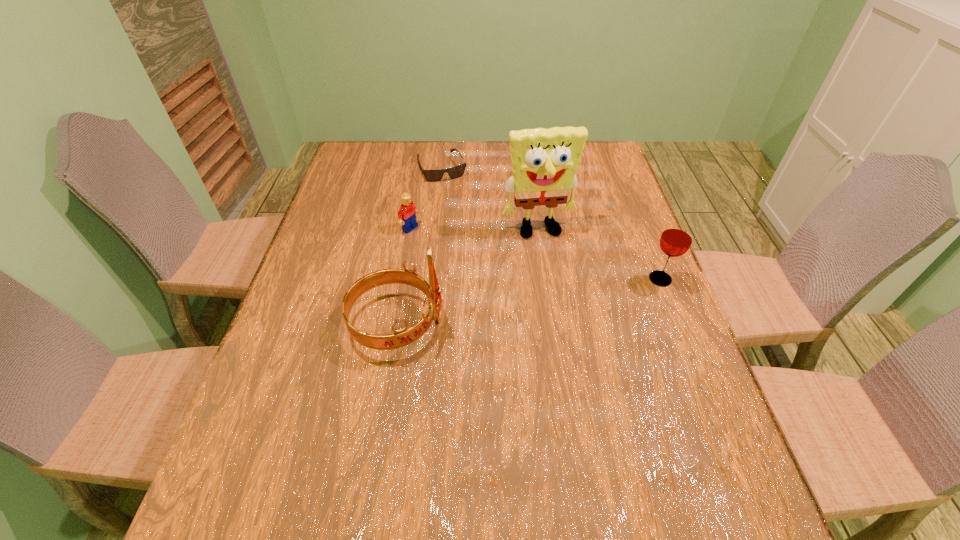
You are a GUI agent. You are given a task and a screenshot of the screen. Output one action in this format:
    pyautogui.click(x=<x>, y=<y>)
    Task: Click on the tiara
    The image size is (960, 540).
    Given the screenshot: What is the action you would take?
    pyautogui.click(x=402, y=337)

You are a GUI agent. You are given a task and a screenshot of the screen. Output one action in this format:
    pyautogui.click(x=<x>, y=<y>)
    Task: Click on the nearest object
    
    Given the screenshot: What is the action you would take?
    pyautogui.click(x=402, y=337)

Locate an element on the screen. The height and width of the screenshot is (540, 960). glass is located at coordinates (676, 239).

The width and height of the screenshot is (960, 540). I want to click on the rightmost object, so click(x=676, y=239).

Find the location of a particular element. This screenshot has width=960, height=540. the second object from right to left is located at coordinates (544, 161).

At what (x,y) coordinates should I click in order to perform the action: click on the tallest object. Please return your answer as a coordinate pair (x, y). Image resolution: width=960 pixels, height=540 pixels. Looking at the image, I should click on (544, 161).

At what (x,y) coordinates should I click in order to perform the action: click on the farthest object. Please return your answer as a coordinate pair (x, y). Looking at the image, I should click on (454, 172).

At what (x,y) coordinates should I click in order to perform the action: click on the shortest object. Please return your answer as a coordinate pair (x, y). Looking at the image, I should click on (454, 172).

Identify the location of Lego. Image resolution: width=960 pixels, height=540 pixels. (407, 214).

Locate an element on the screen. Image resolution: width=960 pixels, height=540 pixels. vacant area located on the front-facing side of the fourth shortest object is located at coordinates click(x=549, y=323).